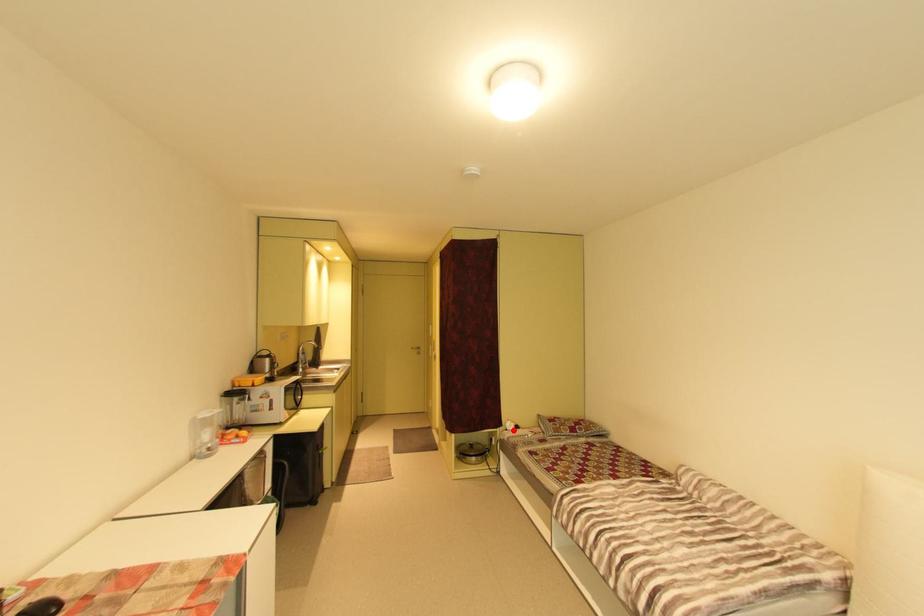
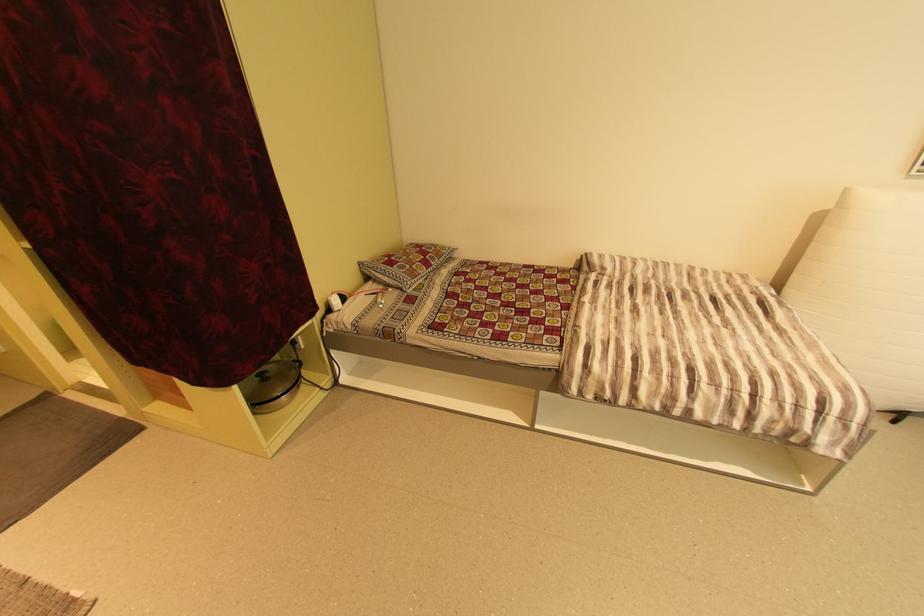
Question: I am providing you with two images of the same scene from different viewpoints. Given a red point in image1, look at the same physical point in image2. Is it:

Choices:
 (A) Closer to the viewpoint
 (B) Farther from the viewpoint

Answer: (A)